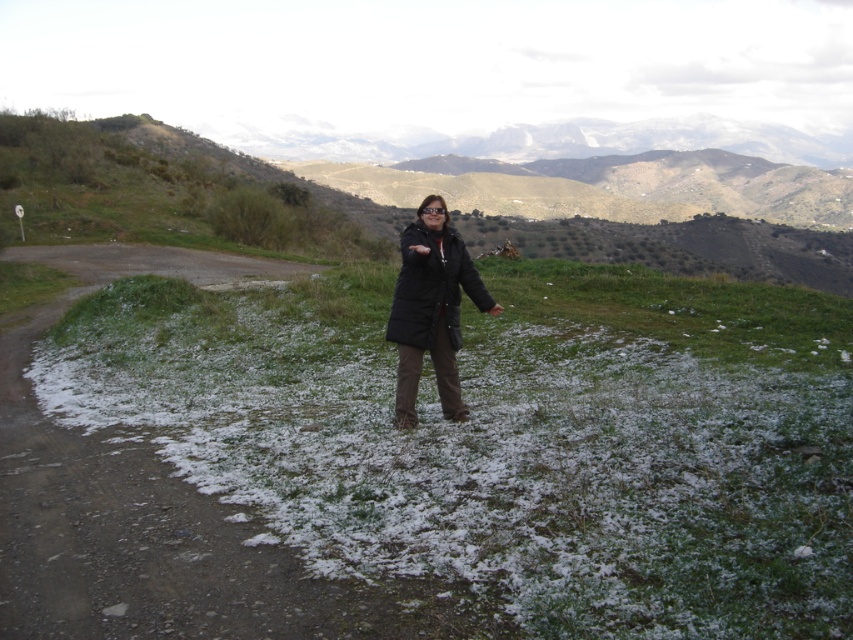
Question: Is white powdery snow at center thinner than black matte jacket at center?

Choices:
 (A) no
 (B) yes

Answer: (A)

Question: Which point appears farthest from the camera in this image?

Choices:
 (A) (457, 275)
 (B) (776, 472)

Answer: (A)

Question: Does white powdery snow at center appear under black matte jacket at center?

Choices:
 (A) yes
 (B) no

Answer: (A)

Question: Is white powdery snow at center above black matte jacket at center?

Choices:
 (A) no
 (B) yes

Answer: (A)

Question: Which point is farther to the camera?

Choices:
 (A) white powdery snow at center
 (B) black matte jacket at center

Answer: (B)